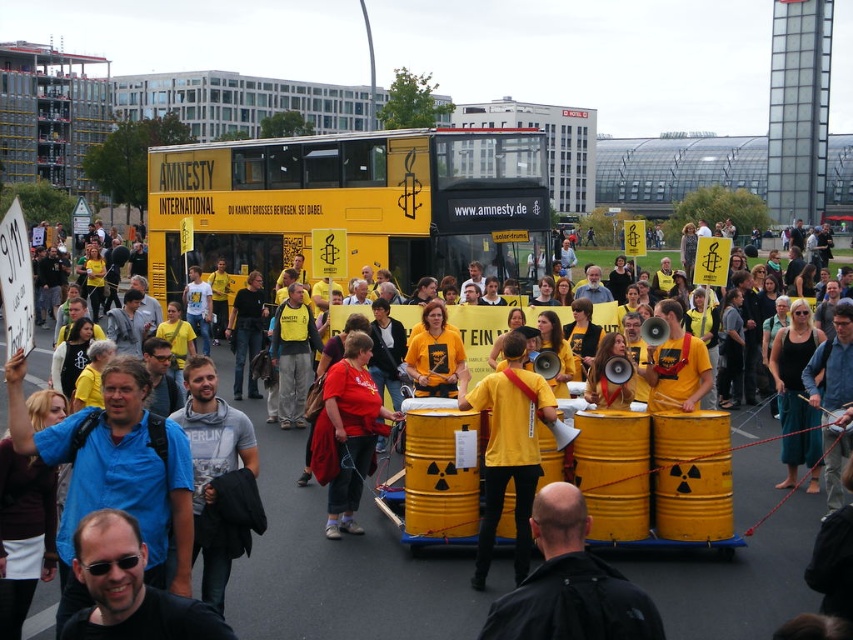
You are a photographer standing at the edge of the protest crowd. You want to take a photo of the black fabric jacket at lower center without the yellow matte drum at center blocking it. How should you adjust your position?

The black fabric jacket at lower center is behind the yellow matte drum at center, so to avoid the drum blocking the jacket, you should move to a position where you can see behind the drum. This might involve moving to the side of the drum or positioning yourself behind it to capture the jacket without obstruction.

You are a photographer standing at the edge of the protest crowd. You want to take a photo that includes both the yellow matte drum at center and the black fabric jacket at lower center. Which object should you position closer to the bottom of your camera frame?

The black fabric jacket at lower center should be positioned closer to the bottom of the camera frame because the yellow matte drum at center is above it.

You are a photographer trying to capture a photo of the protest. You notice two shirts in the crowd at the center of the image, a blue cotton shirt at center and a yellow matte shirt at center. Which shirt do you think would appear wider in the photo?

The blue cotton shirt at center appears wider than the yellow matte shirt at center in the photo because its width is larger.